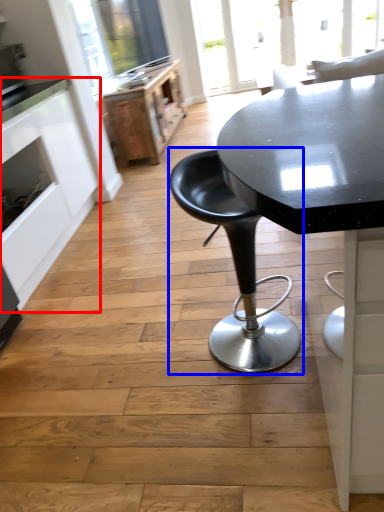
Question: Which of the following is the farthest to the observer, cabinetry (highlighted by a red box) or chair (highlighted by a blue box)?

Choices:
 (A) cabinetry
 (B) chair

Answer: (A)